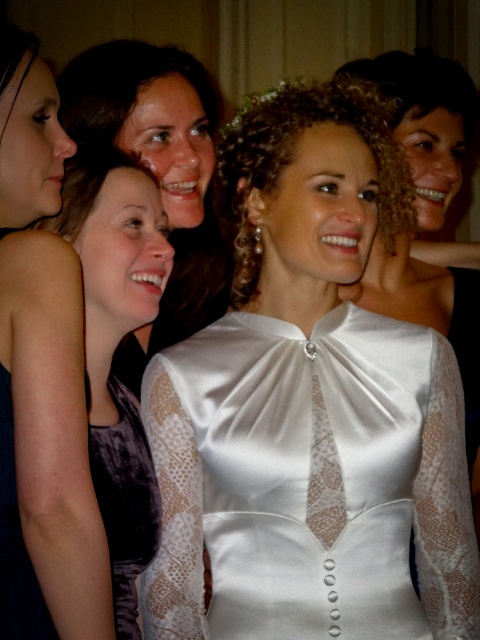
Question: Which point appears farthest from the camera in this image?

Choices:
 (A) (59, 193)
 (B) (158, 214)

Answer: (B)

Question: Can you confirm if satin white dress at center is bigger than matte black dress at left?

Choices:
 (A) yes
 (B) no

Answer: (A)

Question: Based on their relative distances, which object is nearer to the velvet purple dress at lower left?

Choices:
 (A) satin white dress at center
 (B) matte black dress at left

Answer: (A)

Question: Observing the image, what is the correct spatial positioning of satin white dress at center in reference to matte purple dress at center?

Choices:
 (A) left
 (B) right

Answer: (B)

Question: Among these objects, which one is farthest from the camera?

Choices:
 (A) matte black dress at left
 (B) velvet purple dress at lower left

Answer: (B)

Question: Can you confirm if satin white dress at center is thinner than matte purple dress at center?

Choices:
 (A) yes
 (B) no

Answer: (B)